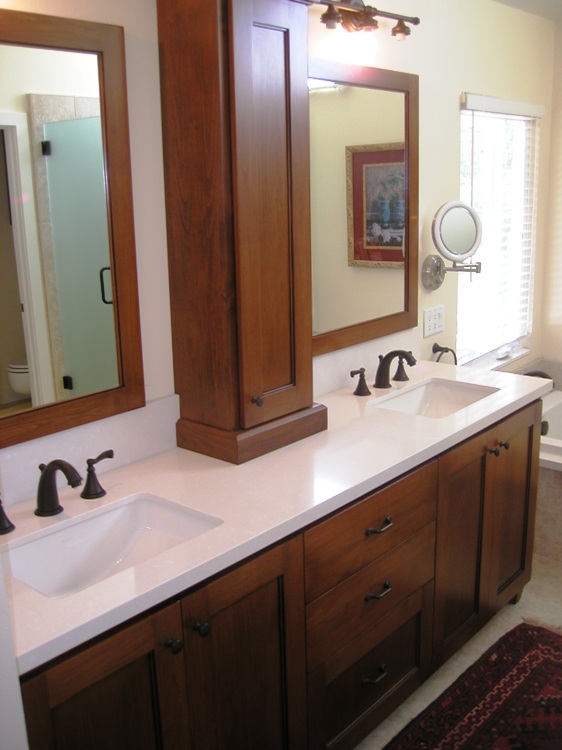
The width and height of the screenshot is (562, 750). What are the coordinates of `drawers` in the screenshot? It's located at tap(352, 537), tap(355, 598), tap(380, 667).